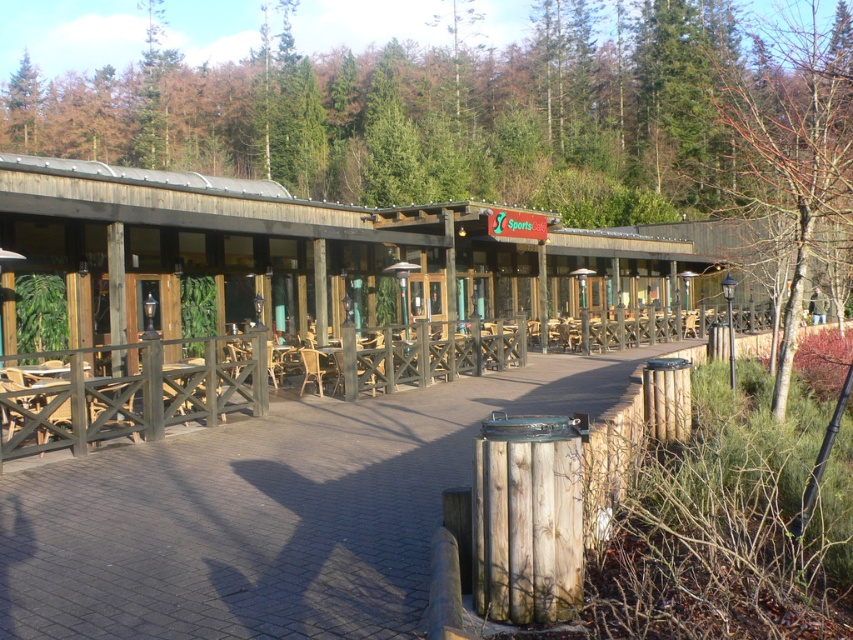
In the scene shown: You are a delivery person trying to carry a large box that is 2 meters wide. You need to pass through the wooden walkway at center and the bare branches at right. Which path will allow you to pass through without needing to adjust the box?

The bare branches at right have a greater width than the wooden walkway at center, so the box can pass through the bare branches at right without needing to adjust its width.

You are planning to install a new bench between the wooden walkway at center and the bare branches at right. The bench is 2 meters long. Will there be enough space to place the bench between them?

The distance between the wooden walkway at center and the bare branches at right is 17.04 meters. Since the bench is only 2 meters long, there is sufficient space to place it between them.